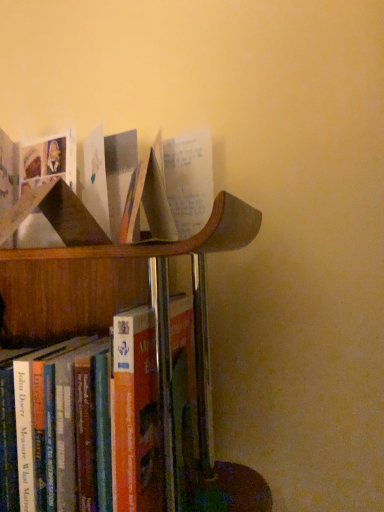
Question: From a real-world perspective, is hardcover book at lower left, arranged as the 2th book when viewed from the top, physically located above or below matte cardboard book at upper left, which is counted as the second book, starting from the bottom?

Choices:
 (A) below
 (B) above

Answer: (A)

Question: Does point (112, 480) appear closer or farther from the camera than point (44, 167)?

Choices:
 (A) closer
 (B) farther

Answer: (A)

Question: Visually, is hardcover book at lower left, the 1th book positioned from the bottom, positioned to the left or to the right of matte cardboard book at upper left, which is counted as the second book, starting from the bottom?

Choices:
 (A) left
 (B) right

Answer: (A)

Question: Is matte cardboard book at upper left, which is counted as the second book, starting from the bottom, taller or shorter than hardcover book at lower left, arranged as the 2th book when viewed from the top?

Choices:
 (A) tall
 (B) short

Answer: (B)

Question: In the image, is matte cardboard book at upper left, marked as the 1th book in a top-to-bottom arrangement, on the left side or the right side of hardcover book at lower left, the 1th book positioned from the bottom?

Choices:
 (A) left
 (B) right

Answer: (B)

Question: Is point (49, 160) positioned closer to the camera than point (147, 431)?

Choices:
 (A) closer
 (B) farther

Answer: (B)

Question: Would you say matte cardboard book at upper left, marked as the 1th book in a top-to-bottom arrangement, is inside or outside hardcover book at lower left, arranged as the 2th book when viewed from the top?

Choices:
 (A) outside
 (B) inside

Answer: (A)